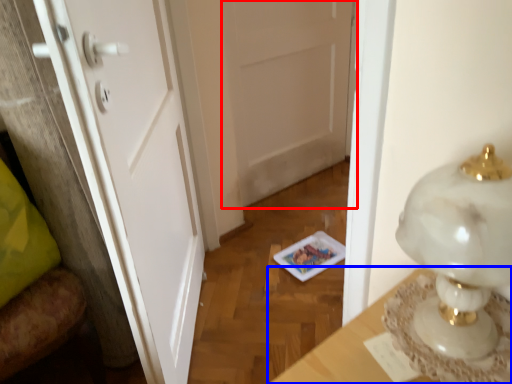
Question: Which object is further to the camera taking this photo, door (highlighted by a red box) or table (highlighted by a blue box)?

Choices:
 (A) door
 (B) table

Answer: (A)